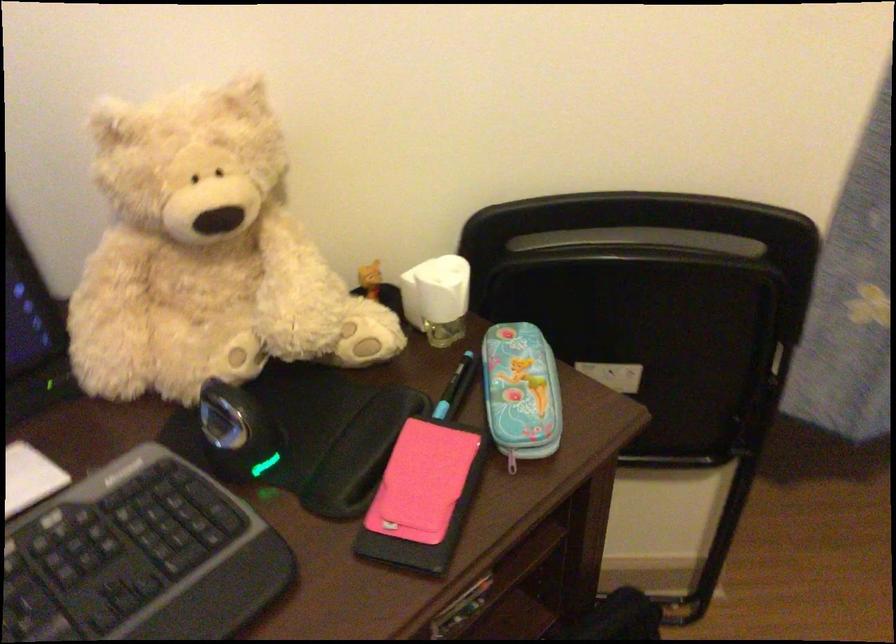
This screenshot has width=896, height=644. I want to click on chair backrest handle, so click(642, 240).